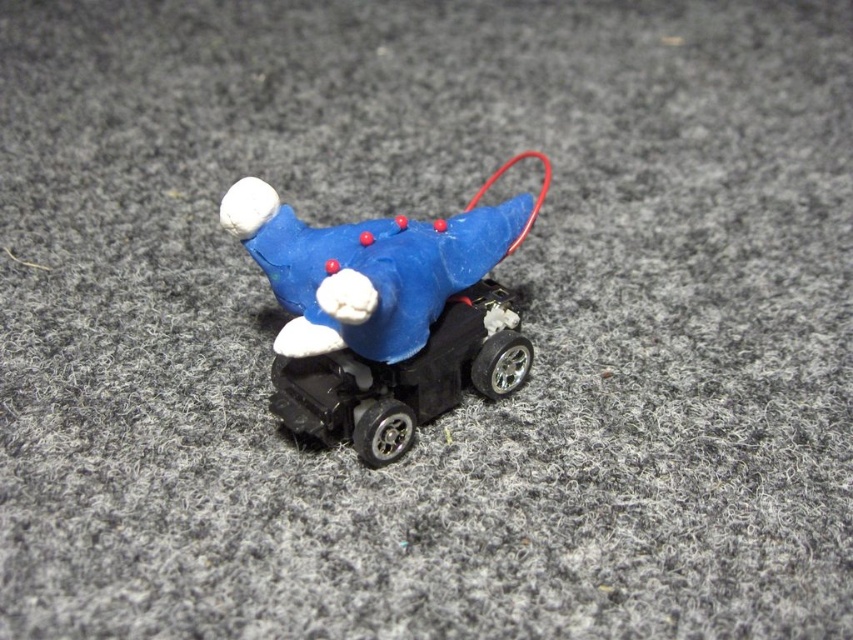
Describe the element at coordinates (386, 312) in the screenshot. Image resolution: width=853 pixels, height=640 pixels. I see `blue matte/black plastic toy at center` at that location.

Measure the distance from blue matte/black plastic toy at center to black plastic car at center.

blue matte/black plastic toy at center is 1.35 inches away from black plastic car at center.

Is point (485, 284) farther from camera compared to point (355, 419)?

Yes, it is behind point (355, 419).

At what (x,y) coordinates should I click in order to perform the action: click on blue matte/black plastic toy at center. Please return your answer as a coordinate pair (x, y). The image size is (853, 640). Looking at the image, I should click on (386, 312).